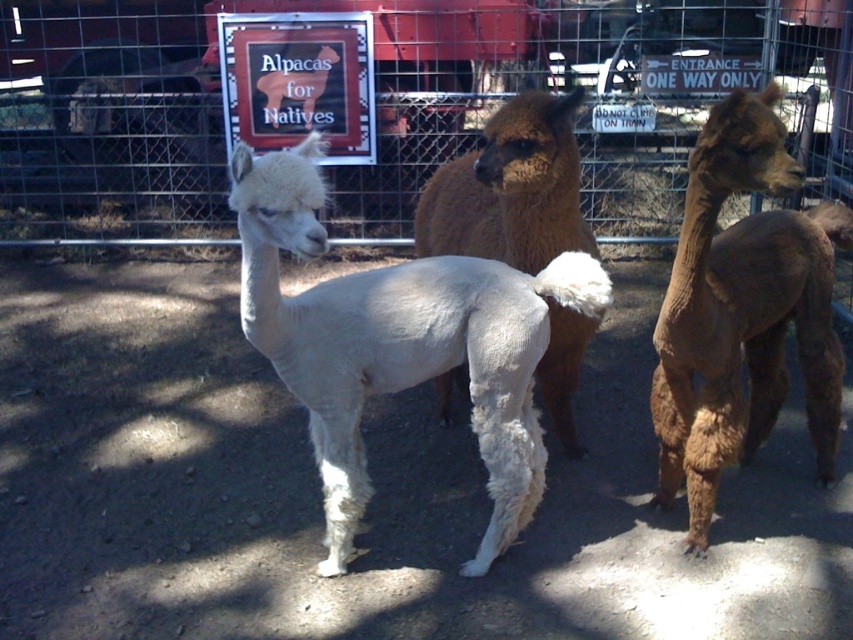
Does white fluffy alpaca at center appear over brown fuzzy alpaca at right?

No.

Can you confirm if white fluffy alpaca at center is wider than brown fuzzy alpaca at right?

Correct, the width of white fluffy alpaca at center exceeds that of brown fuzzy alpaca at right.

Is point (329, 300) positioned after point (697, 474)?

No, (329, 300) is in front of (697, 474).

The width and height of the screenshot is (853, 640). Find the location of `white fluffy alpaca at center`. white fluffy alpaca at center is located at coordinates (397, 342).

Does metal wire fence at center have a larger size compared to brown fuzzy alpaca at center?

Yes, metal wire fence at center is bigger than brown fuzzy alpaca at center.

Is metal wire fence at center thinner than brown fuzzy alpaca at center?

No, metal wire fence at center is not thinner than brown fuzzy alpaca at center.

I want to click on metal wire fence at center, so click(x=384, y=102).

In the scene shown: Is metal wire fence at center bigger than white fluffy alpaca at center?

Yes.

Can you confirm if metal wire fence at center is wider than white fluffy alpaca at center?

Indeed, metal wire fence at center has a greater width compared to white fluffy alpaca at center.

Does point (3, 230) lie behind point (311, 298)?

That is True.

This screenshot has height=640, width=853. In order to click on metal wire fence at center in this screenshot , I will do `click(384, 102)`.